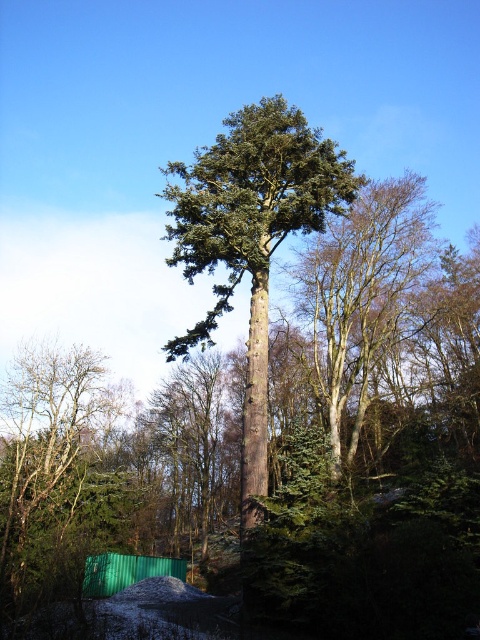
Question: Is green textured tree at center below green matte tree at lower left?

Choices:
 (A) no
 (B) yes

Answer: (A)

Question: Does green matte tree at lower left have a larger size compared to green rough bark tree at center?

Choices:
 (A) no
 (B) yes

Answer: (B)

Question: In this image, where is green matte tree at lower left located relative to green rough bark tree at center?

Choices:
 (A) above
 (B) below

Answer: (B)

Question: Which object appears farthest from the camera in this image?

Choices:
 (A) green matte tree at lower left
 (B) green textured tree at center
 (C) green rough bark tree at center

Answer: (C)

Question: Which of the following is the farthest from the observer?

Choices:
 (A) (226, 253)
 (B) (48, 548)

Answer: (B)

Question: Which object is positioned farthest from the green rough bark tree at center?

Choices:
 (A) green textured tree at center
 (B) green matte tree at lower left

Answer: (B)